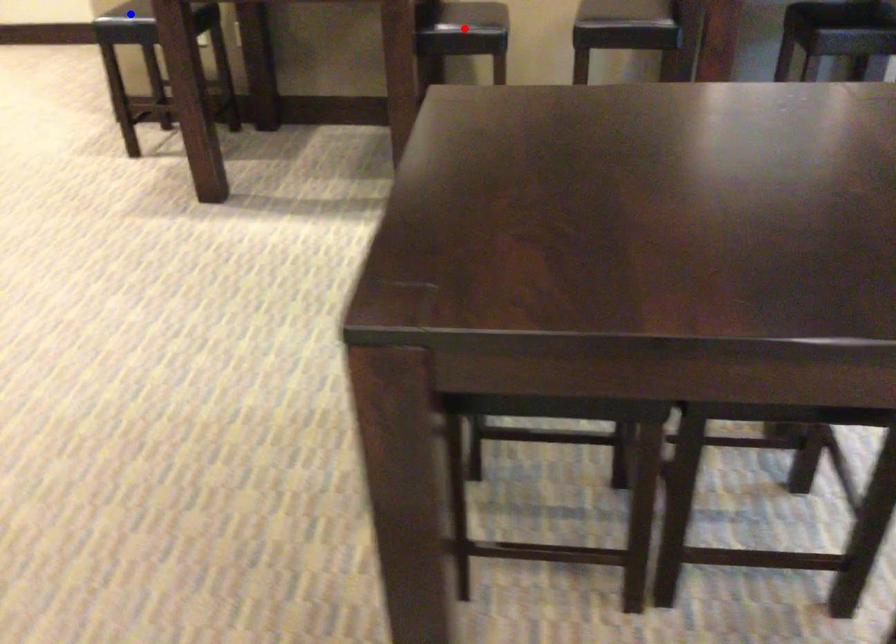
Question: In the image, two points are highlighted. Which point is nearer to the camera? Reply with the corresponding letter.

Choices:
 (A) blue point
 (B) red point

Answer: (B)